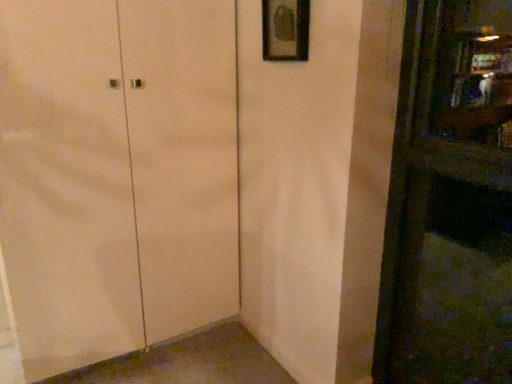
Question: Which is correct: matte white cabinet at center is inside matte black picture frame at upper center, or outside of it?

Choices:
 (A) inside
 (B) outside

Answer: (B)

Question: Is matte white cabinet at center wider or thinner than matte black picture frame at upper center?

Choices:
 (A) thin
 (B) wide

Answer: (B)

Question: Based on their positions, is matte white cabinet at center located to the left or right of matte black picture frame at upper center?

Choices:
 (A) left
 (B) right

Answer: (A)

Question: From the image's perspective, is matte black picture frame at upper center positioned above or below matte white cabinet at center?

Choices:
 (A) above
 (B) below

Answer: (A)

Question: Would you say matte black picture frame at upper center is to the left or to the right of matte white cabinet at center in the picture?

Choices:
 (A) left
 (B) right

Answer: (B)

Question: From a real-world perspective, is matte black picture frame at upper center positioned above or below matte white cabinet at center?

Choices:
 (A) below
 (B) above

Answer: (B)

Question: In terms of width, does matte black picture frame at upper center look wider or thinner when compared to matte white cabinet at center?

Choices:
 (A) wide
 (B) thin

Answer: (B)